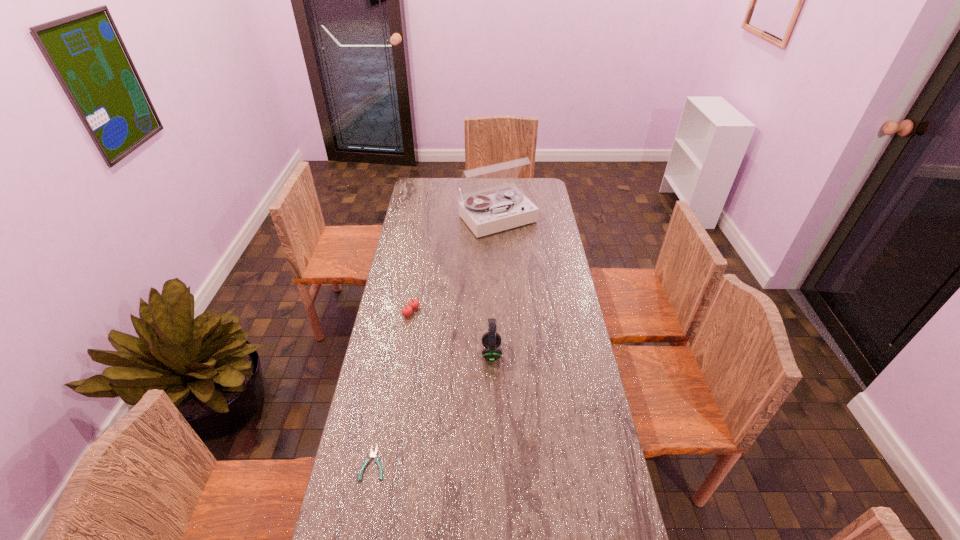
At what (x,y) coordinates should I click in order to perform the action: click on free region located 0.340m on the ear cups of the third shortest object. Please return your answer as a coordinate pair (x, y). The image size is (960, 540). Looking at the image, I should click on (391, 353).

Locate an element on the screen. free location located on the ear cups of the third shortest object is located at coordinates (385, 353).

Locate an element on the screen. free point located on the front of the second farthest object is located at coordinates point(404,357).

You are a GUI agent. You are given a task and a screenshot of the screen. Output one action in this format:
    pyautogui.click(x=<x>, y=<y>)
    Task: Click on the vacant area situated 0.170m on the right of the shortest object
    This screenshot has height=540, width=960.
    Given the screenshot: What is the action you would take?
    pyautogui.click(x=442, y=463)

At what (x,y) coordinates should I click in order to perform the action: click on object present at the far edge. Please return your answer as a coordinate pair (x, y). Looking at the image, I should click on (484, 214).

I want to click on cherry positioned at the left edge, so click(414, 303).

Where is `pliers that is positioned at the left edge`? The width and height of the screenshot is (960, 540). pliers that is positioned at the left edge is located at coordinates (372, 454).

This screenshot has height=540, width=960. In order to click on object situated at the right edge in this screenshot , I will do `click(484, 214)`.

You are a GUI agent. You are given a task and a screenshot of the screen. Output one action in this format:
    pyautogui.click(x=<x>, y=<y>)
    Task: Click on the object at the far right corner
    Image resolution: width=960 pixels, height=540 pixels.
    Given the screenshot: What is the action you would take?
    pyautogui.click(x=484, y=214)

Locate an element on the screen. The image size is (960, 540). free space at the left edge of the desktop is located at coordinates (397, 370).